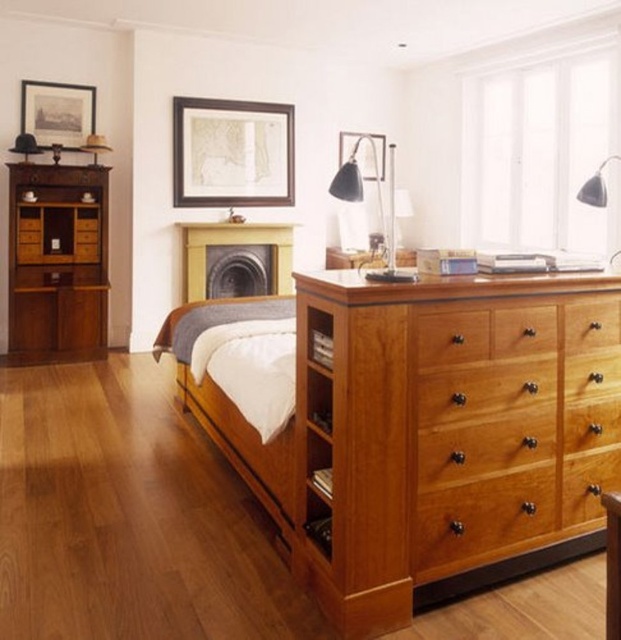
Question: Does cherry wood dresser at lower right lie in front of matte black picture frame at upper center?

Choices:
 (A) yes
 (B) no

Answer: (A)

Question: Which of the following is the farthest from the observer?

Choices:
 (A) (50, 260)
 (B) (337, 621)
 (C) (383, 148)
 (D) (292, 227)

Answer: (C)

Question: In this image, where is matte black fireplace at center located relative to matte black picture frame at upper left?

Choices:
 (A) above
 (B) below

Answer: (B)

Question: Which of the following is the farthest from the observer?

Choices:
 (A) [605, 193]
 (B) [376, 154]

Answer: (B)

Question: Based on their relative distances, which object is nearer to the light brown wooden bed at center?

Choices:
 (A) cherry wood dresser at lower right
 (B) black glass lamp at center

Answer: (A)

Question: Can you confirm if black glass lamp at center is positioned below matte black lampshade at upper right?

Choices:
 (A) no
 (B) yes

Answer: (B)